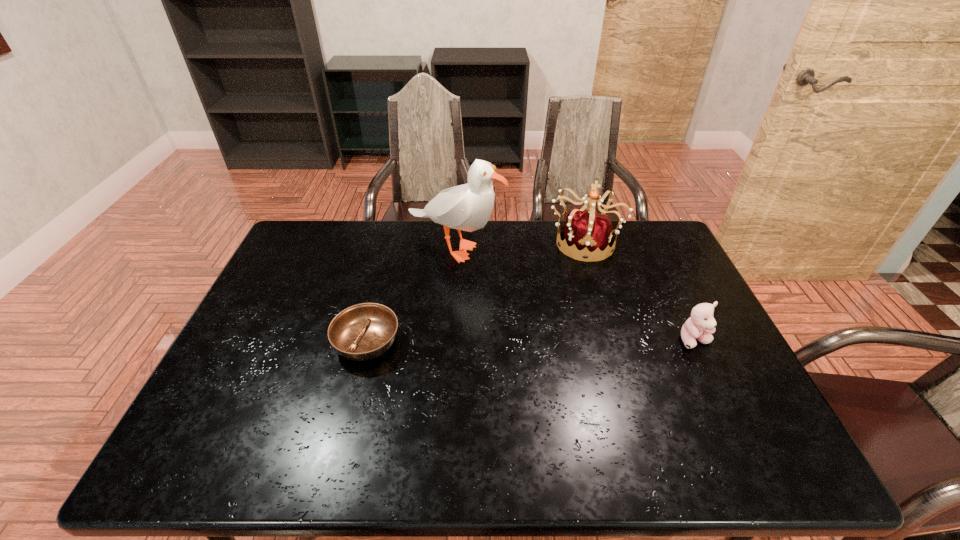
Image resolution: width=960 pixels, height=540 pixels. Find the location of `free space at the far left corner of the desktop`. free space at the far left corner of the desktop is located at coordinates (300, 233).

The width and height of the screenshot is (960, 540). What are the coordinates of `vacant space at the far right corner` in the screenshot? It's located at [643, 241].

This screenshot has height=540, width=960. What are the coordinates of `empty space that is in between the gull and the third shortest object` in the screenshot? It's located at (519, 244).

At what (x,y) coordinates should I click in order to perform the action: click on free spot between the gull and the second tallest object. Please return your answer as a coordinate pair (x, y). Image resolution: width=960 pixels, height=540 pixels. Looking at the image, I should click on (519, 244).

You are a GUI agent. You are given a task and a screenshot of the screen. Output one action in this format:
    pyautogui.click(x=<x>, y=<y>)
    Task: Click on the vacant space that is in between the tallest object and the rightmost object
    Image resolution: width=960 pixels, height=540 pixels.
    Given the screenshot: What is the action you would take?
    [x=575, y=293]

Locate an element on the screen. The image size is (960, 540). unoccupied area between the shortest object and the tallest object is located at coordinates (411, 294).

Identify the location of free space between the shortest object and the teddy bear. The height and width of the screenshot is (540, 960). (531, 341).

Locate an element on the screen. This screenshot has width=960, height=540. vacant area that lies between the third tallest object and the tiara is located at coordinates (639, 291).

The height and width of the screenshot is (540, 960). In order to click on vacant region between the soup bowl and the second object from right to left in this screenshot , I will do `click(475, 292)`.

Locate an element on the screen. This screenshot has height=540, width=960. empty location between the tallest object and the second object from right to left is located at coordinates (519, 244).